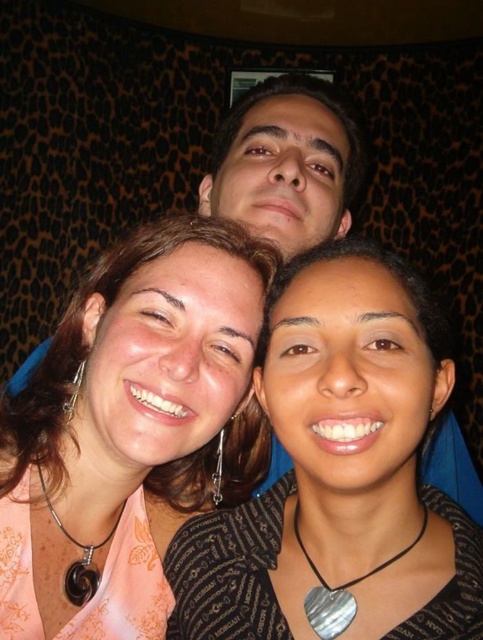
Who is positioned more to the left, matte black hair at center or silver heart-shaped pendant at center?

matte black hair at center

Who is more distant from viewer, (343, 102) or (342, 589)?

Point (343, 102)

Locate an element on the screen. Image resolution: width=483 pixels, height=640 pixels. matte black hair at center is located at coordinates (287, 161).

Locate an element on the screen. matte black hair at center is located at coordinates (287, 161).

Can you confirm if black fabric at center is bigger than black stone pendant at lower left?

Yes, black fabric at center is bigger than black stone pendant at lower left.

Can you confirm if black fabric at center is taller than black stone pendant at lower left?

Correct, black fabric at center is much taller as black stone pendant at lower left.

You are a GUI agent. You are given a task and a screenshot of the screen. Output one action in this format:
    pyautogui.click(x=<x>, y=<y>)
    Task: Click on the black fabric at center
    
    Given the screenshot: What is the action you would take?
    pyautogui.click(x=340, y=472)

Is the position of black fabric at center more distant than that of matte black hair at center?

No.

Is point (416, 401) positioned after point (326, 166)?

No, (416, 401) is closer to viewer.

You are a GUI agent. You are given a task and a screenshot of the screen. Output one action in this format:
    pyautogui.click(x=<x>, y=<y>)
    Task: Click on the black fabric at center
    This screenshot has width=483, height=640.
    Given the screenshot: What is the action you would take?
    pyautogui.click(x=340, y=472)